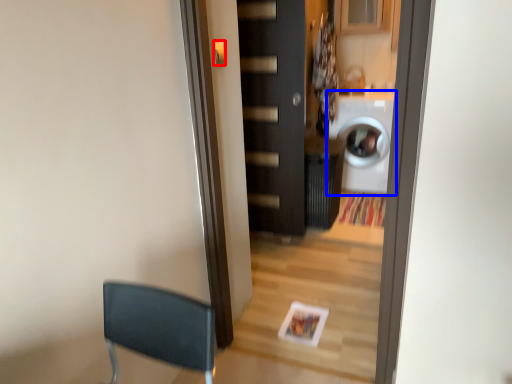
Question: Which of the following is the closest to the observer, door handle (highlighted by a red box) or washing machine (highlighted by a blue box)?

Choices:
 (A) door handle
 (B) washing machine

Answer: (A)